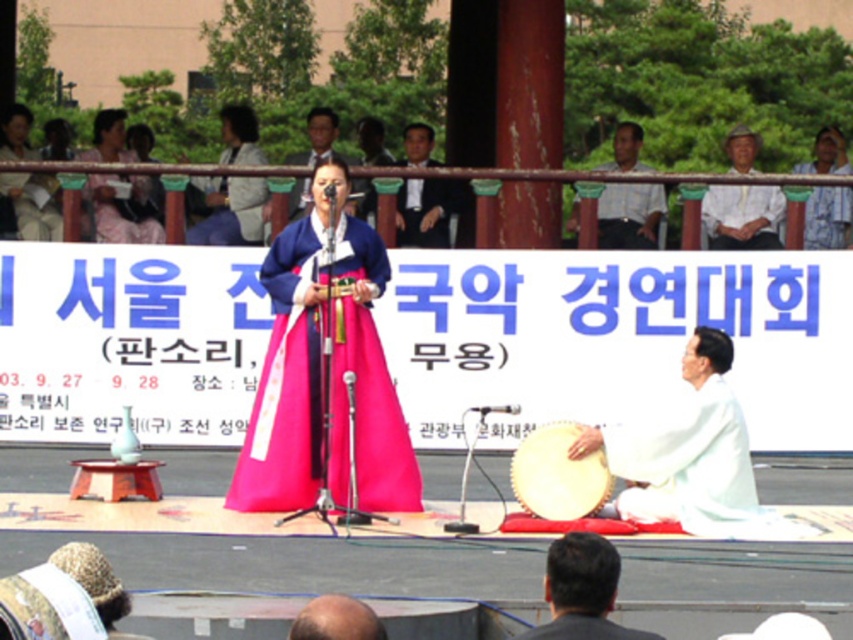
Who is higher up, pink satin hanbok at center or dark suit at upper center?

dark suit at upper center

Does pink satin hanbok at center have a greater height compared to dark suit at upper center?

Indeed, pink satin hanbok at center has a greater height compared to dark suit at upper center.

Find the location of a particular element. The width and height of the screenshot is (853, 640). pink satin hanbok at center is located at coordinates (320, 372).

Locate an element on the screen. Image resolution: width=853 pixels, height=640 pixels. white cotton hat at upper right is located at coordinates (827, 218).

Between white cotton hat at upper right and matte blue kimono at center, which one is positioned higher?

matte blue kimono at center is above.

Which is in front, point (844, 216) or point (291, 212)?

Positioned in front is point (291, 212).

The width and height of the screenshot is (853, 640). Find the location of `white cotton hat at upper right`. white cotton hat at upper right is located at coordinates (827, 218).

Is point (701, 449) in front of point (529, 493)?

Yes, it is in front of point (529, 493).

The width and height of the screenshot is (853, 640). What do you see at coordinates (683, 445) in the screenshot?
I see `white cloth drum at center` at bounding box center [683, 445].

What are the coordinates of `white cloth drum at center` in the screenshot? It's located at (683, 445).